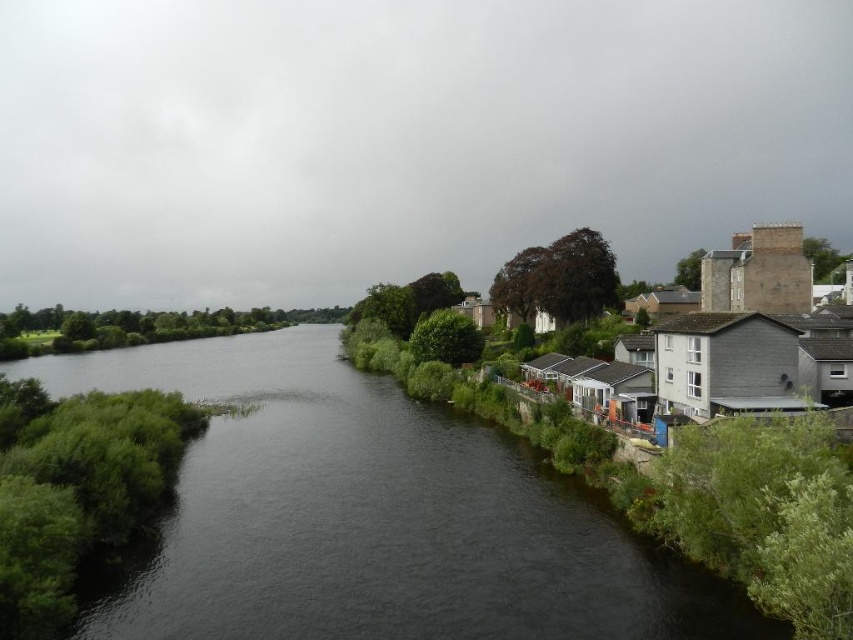
Question: Can you confirm if dark water at center is positioned below gray stone houses at right?

Choices:
 (A) no
 (B) yes

Answer: (B)

Question: Which object appears closest to the camera in this image?

Choices:
 (A) dark water at center
 (B) gray stone houses at right

Answer: (A)

Question: Among these points, which one is nearest to the camera?

Choices:
 (A) (799, 248)
 (B) (524, 515)

Answer: (B)

Question: Does dark water at center appear over gray stone houses at right?

Choices:
 (A) yes
 (B) no

Answer: (B)

Question: Is dark water at center bigger than gray stone houses at right?

Choices:
 (A) no
 (B) yes

Answer: (B)